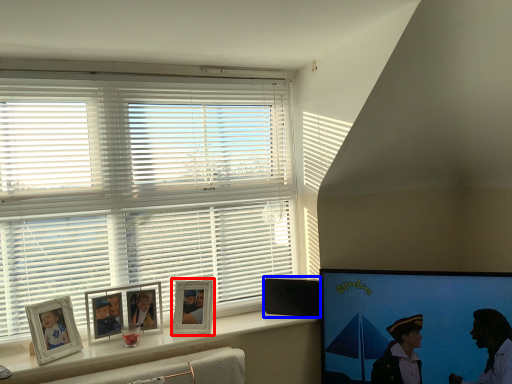
Question: Among these objects, which one is farthest to the camera, picture frame (highlighted by a red box) or speaker (highlighted by a blue box)?

Choices:
 (A) picture frame
 (B) speaker

Answer: (B)